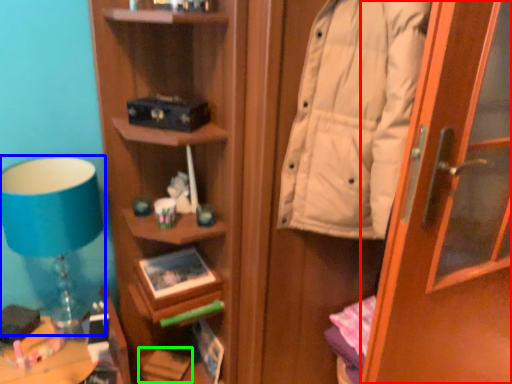
Question: Considering the real-world distances, which object is closest to door (highlighted by a red box)? table lamp (highlighted by a blue box) or book (highlighted by a green box).

Choices:
 (A) table lamp
 (B) book

Answer: (A)